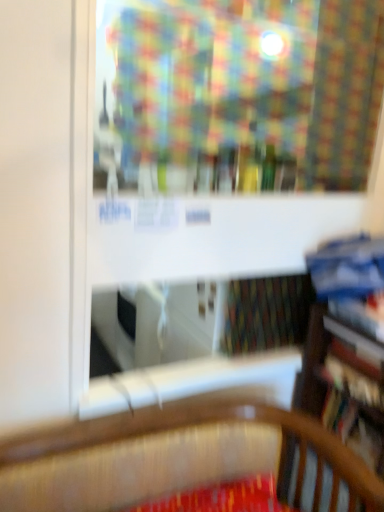
What do you see at coordinates (354, 428) in the screenshot? The width and height of the screenshot is (384, 512). I see `hardcover book at right, which is counted as the 4th book, starting from the top` at bounding box center [354, 428].

This screenshot has height=512, width=384. What are the coordinates of `blue hardcover book at right, which is counted as the 4th book, starting from the bottom` in the screenshot? It's located at (350, 279).

Is hardcover book at right, marked as the first book in a bottom-to-top arrangement, completely or partially outside of blue hardcover book at right, which is counted as the 4th book, starting from the bottom?

→ hardcover book at right, marked as the first book in a bottom-to-top arrangement, lies outside blue hardcover book at right, which is counted as the 4th book, starting from the bottom,'s area.

From a real-world perspective, is hardcover book at right, marked as the first book in a bottom-to-top arrangement, above or below blue hardcover book at right, the 1th book from the top?

hardcover book at right, marked as the first book in a bottom-to-top arrangement, is below blue hardcover book at right, the 1th book from the top.

Which object is thinner, hardcover book at right, which is counted as the 4th book, starting from the top, or blue hardcover book at right, the 1th book from the top?

hardcover book at right, which is counted as the 4th book, starting from the top.

Is hardcover book at right, marked as the first book in a bottom-to-top arrangement, at the right side of blue hardcover book at right, which is counted as the 4th book, starting from the bottom?

Indeed, hardcover book at right, marked as the first book in a bottom-to-top arrangement, is positioned on the right side of blue hardcover book at right, which is counted as the 4th book, starting from the bottom.

In terms of height, does blue hardcover book at right, which is counted as the 4th book, starting from the bottom, look taller or shorter compared to hardcover book at right, marked as the first book in a bottom-to-top arrangement?

blue hardcover book at right, which is counted as the 4th book, starting from the bottom, is taller than hardcover book at right, marked as the first book in a bottom-to-top arrangement.

From the image's perspective, is blue hardcover book at right, which is counted as the 4th book, starting from the bottom, positioned above or below hardcover book at right, marked as the first book in a bottom-to-top arrangement?

blue hardcover book at right, which is counted as the 4th book, starting from the bottom, is above hardcover book at right, marked as the first book in a bottom-to-top arrangement.

Is point (382, 319) less distant than point (361, 426)?

Yes, point (382, 319) is closer to viewer.

Can you tell me how much blue hardcover book at right, which is counted as the 4th book, starting from the bottom, and hardcover book at right, which is counted as the 4th book, starting from the top, differ in facing direction?

The angular difference between blue hardcover book at right, which is counted as the 4th book, starting from the bottom, and hardcover book at right, which is counted as the 4th book, starting from the top, is 0.432 degrees.

Looking at this image, does blue hardcover book at right, which is counted as the 4th book, starting from the bottom, have a greater height compared to hardcover book at right, the 2th book from the bottom?

Yes, blue hardcover book at right, which is counted as the 4th book, starting from the bottom, is taller than hardcover book at right, the 2th book from the bottom.

Find the location of `book that appears on the left of blue hardcover book at right, the 1th book from the top`. book that appears on the left of blue hardcover book at right, the 1th book from the top is located at coordinates (356, 349).

Can hardcover book at right, the 2th book from the bottom, be found inside blue hardcover book at right, the 1th book from the top?

No, hardcover book at right, the 2th book from the bottom, is not inside blue hardcover book at right, the 1th book from the top.

Which is closer, (370, 279) or (367, 307)?

Point (370, 279)

From the image's perspective, is blue hardcover book at right, which is counted as the 4th book, starting from the bottom, positioned above or below hardcover book at right, acting as the 2th book starting from the top?

blue hardcover book at right, which is counted as the 4th book, starting from the bottom, is situated higher than hardcover book at right, acting as the 2th book starting from the top, in the image.

Which of these two, blue hardcover book at right, the 1th book from the top, or hardcover book at right, acting as the 2th book starting from the top, is smaller?

With smaller size is hardcover book at right, acting as the 2th book starting from the top.

Are blue hardcover book at right, which is counted as the 4th book, starting from the bottom, and hardcover book at right, which is counted as the third book, starting from the bottom, making contact?

Yes, blue hardcover book at right, which is counted as the 4th book, starting from the bottom, is with hardcover book at right, which is counted as the third book, starting from the bottom.

How different are the orientations of hardcover book at right, which is counted as the third book, starting from the bottom, and blue hardcover book at right, which is counted as the 4th book, starting from the bottom, in degrees?

0.515 degrees separate the facing orientations of hardcover book at right, which is counted as the third book, starting from the bottom, and blue hardcover book at right, which is counted as the 4th book, starting from the bottom.

I want to click on book located in front of the hardcover book at right, which is counted as the third book, starting from the bottom, so click(x=350, y=279).

Is hardcover book at right, acting as the 2th book starting from the top, aimed at blue hardcover book at right, the 1th book from the top?

No, hardcover book at right, acting as the 2th book starting from the top, is not turned towards blue hardcover book at right, the 1th book from the top.

Looking at their sizes, would you say hardcover book at right, which is counted as the third book, starting from the bottom, is wider or thinner than blue hardcover book at right, the 1th book from the top?

In the image, hardcover book at right, which is counted as the third book, starting from the bottom, appears to be more narrow than blue hardcover book at right, the 1th book from the top.

Considering the sizes of objects hardcover book at right, the 2th book from the bottom, and hardcover book at right, which is counted as the 4th book, starting from the top, in the image provided, who is wider, hardcover book at right, the 2th book from the bottom, or hardcover book at right, which is counted as the 4th book, starting from the top,?

hardcover book at right, which is counted as the 4th book, starting from the top, is wider.

Can you tell me how much hardcover book at right, marked as the third book in a top-to-bottom arrangement, and hardcover book at right, which is counted as the 4th book, starting from the top, differ in facing direction?

0.632 degrees separate the facing orientations of hardcover book at right, marked as the third book in a top-to-bottom arrangement, and hardcover book at right, which is counted as the 4th book, starting from the top.

From a real-world perspective, is hardcover book at right, marked as the third book in a top-to-bottom arrangement, physically located above or below hardcover book at right, marked as the first book in a bottom-to-top arrangement?

In terms of real-world spatial position, hardcover book at right, marked as the third book in a top-to-bottom arrangement, is above hardcover book at right, marked as the first book in a bottom-to-top arrangement.

Which is more to the left, hardcover book at right, the 2th book from the bottom, or hardcover book at right, marked as the first book in a bottom-to-top arrangement?

hardcover book at right, the 2th book from the bottom.

Is hardcover book at right, acting as the 2th book starting from the top, aimed at hardcover book at right, which is counted as the 4th book, starting from the top?

No, hardcover book at right, acting as the 2th book starting from the top, does not turn towards hardcover book at right, which is counted as the 4th book, starting from the top.

Is hardcover book at right, which is counted as the third book, starting from the bottom, further to the viewer compared to hardcover book at right, which is counted as the 4th book, starting from the top?

No.

Can you tell me how much hardcover book at right, acting as the 2th book starting from the top, and hardcover book at right, marked as the first book in a bottom-to-top arrangement, differ in facing direction?

The angular difference between hardcover book at right, acting as the 2th book starting from the top, and hardcover book at right, marked as the first book in a bottom-to-top arrangement, is 0.0831 degrees.

Which of these two, hardcover book at right, acting as the 2th book starting from the top, or hardcover book at right, which is counted as the 4th book, starting from the top, is thinner?

hardcover book at right, which is counted as the 4th book, starting from the top, is thinner.

Find the location of a particular element. The height and width of the screenshot is (512, 384). the 3rd book in front of the hardcover book at right, marked as the first book in a bottom-to-top arrangement, starting your count from the anchor is located at coordinates (350, 279).

Starting from the blue hardcover book at right, the 1th book from the top, which book is the 3rd one behind? Please provide its 2D coordinates.

[(354, 428)]

Looking at this image, looking at the image, which one is located further to blue hardcover book at right, which is counted as the 4th book, starting from the bottom, hardcover book at right, which is counted as the third book, starting from the bottom, or hardcover book at right, marked as the first book in a bottom-to-top arrangement?

Based on the image, hardcover book at right, marked as the first book in a bottom-to-top arrangement, appears to be further to blue hardcover book at right, which is counted as the 4th book, starting from the bottom.

Based on their spatial positions, is hardcover book at right, the 2th book from the bottom, or blue hardcover book at right, which is counted as the 4th book, starting from the bottom, closer to hardcover book at right, marked as the first book in a bottom-to-top arrangement?

Based on the image, hardcover book at right, the 2th book from the bottom, appears to be nearer to hardcover book at right, marked as the first book in a bottom-to-top arrangement.

Estimate the real-world distances between objects in this image. Which object is further from hardcover book at right, acting as the 2th book starting from the top, hardcover book at right, the 2th book from the bottom, or hardcover book at right, which is counted as the 4th book, starting from the top?

The object further to hardcover book at right, acting as the 2th book starting from the top, is hardcover book at right, which is counted as the 4th book, starting from the top.

Considering their positions, is hardcover book at right, which is counted as the 4th book, starting from the top, positioned closer to hardcover book at right, the 2th book from the bottom, than hardcover book at right, acting as the 2th book starting from the top?

hardcover book at right, acting as the 2th book starting from the top, is positioned closer to the anchor hardcover book at right, the 2th book from the bottom.

Which object lies further to the anchor point hardcover book at right, acting as the 2th book starting from the top, blue hardcover book at right, the 1th book from the top, or hardcover book at right, marked as the first book in a bottom-to-top arrangement?

Among the two, hardcover book at right, marked as the first book in a bottom-to-top arrangement, is located further to hardcover book at right, acting as the 2th book starting from the top.

Estimate the real-world distances between objects in this image. Which object is further from hardcover book at right, acting as the 2th book starting from the top, hardcover book at right, which is counted as the 4th book, starting from the top, or blue hardcover book at right, the 1th book from the top?

Among the two, hardcover book at right, which is counted as the 4th book, starting from the top, is located further to hardcover book at right, acting as the 2th book starting from the top.

Estimate the real-world distances between objects in this image. Which object is further from blue hardcover book at right, which is counted as the 4th book, starting from the bottom, hardcover book at right, the 2th book from the bottom, or hardcover book at right, which is counted as the 4th book, starting from the top?

Among the two, hardcover book at right, which is counted as the 4th book, starting from the top, is located further to blue hardcover book at right, which is counted as the 4th book, starting from the bottom.

Looking at the image, which one is located further to hardcover book at right, which is counted as the third book, starting from the bottom, hardcover book at right, marked as the third book in a top-to-bottom arrangement, or blue hardcover book at right, the 1th book from the top?

Based on the image, hardcover book at right, marked as the third book in a top-to-bottom arrangement, appears to be further to hardcover book at right, which is counted as the third book, starting from the bottom.

This screenshot has height=512, width=384. What are the coordinates of `book between blue hardcover book at right, which is counted as the 4th book, starting from the bottom, and hardcover book at right, marked as the third book in a top-to-bottom arrangement, vertically` in the screenshot? It's located at click(361, 314).

Where is `book between hardcover book at right, which is counted as the third book, starting from the bottom, and hardcover book at right, which is counted as the 4th book, starting from the top, from top to bottom`? book between hardcover book at right, which is counted as the third book, starting from the bottom, and hardcover book at right, which is counted as the 4th book, starting from the top, from top to bottom is located at coordinates (356, 349).